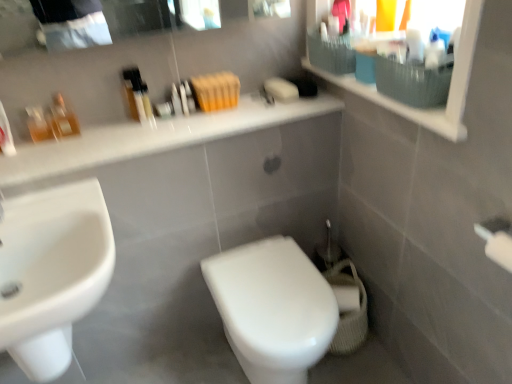
Find the location of a particular element. The height and width of the screenshot is (384, 512). vacant space to the right of white glossy faucet at left is located at coordinates (52, 210).